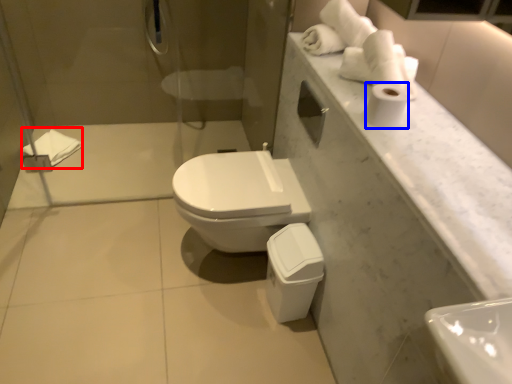
Question: Which object is further to the camera taking this photo, bath towel (highlighted by a red box) or toilet paper (highlighted by a blue box)?

Choices:
 (A) bath towel
 (B) toilet paper

Answer: (A)